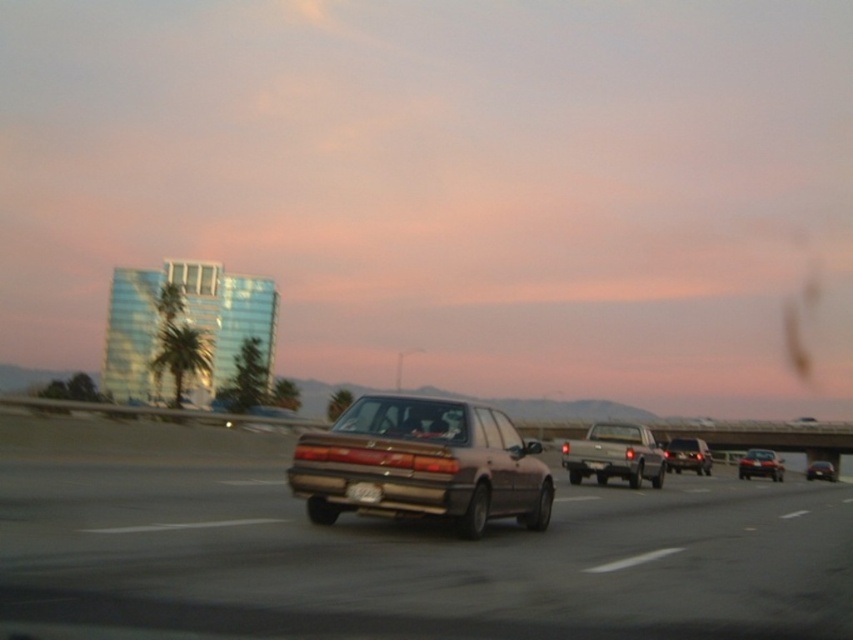
Question: Which of the following is the closest to the observer?

Choices:
 (A) (674, 452)
 (B) (749, 467)

Answer: (A)

Question: Which point is closer to the camera?

Choices:
 (A) (430, 406)
 (B) (381, 604)
 (C) (770, 451)

Answer: (B)

Question: Considering the relative positions of green leafy palm tree at left and metallic silver sedan at center in the image provided, where is green leafy palm tree at left located with respect to metallic silver sedan at center?

Choices:
 (A) above
 (B) below

Answer: (A)

Question: Based on their relative distances, which object is nearer to the satin brown sedan at center?

Choices:
 (A) shiny silver sedan at lower right
 (B) metallic silver sedan at center
 (C) matte black sedan at center
 (D) matte gray sedan at center

Answer: (D)

Question: Is metallic brown car at center below metallic silver sedan at center?

Choices:
 (A) yes
 (B) no

Answer: (B)

Question: Does green leafy palm tree at left have a lesser width compared to black plastic license plate at center?

Choices:
 (A) yes
 (B) no

Answer: (B)